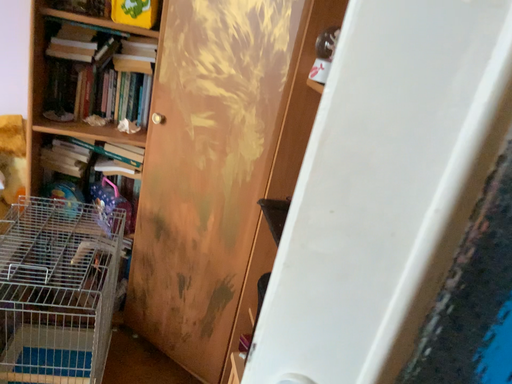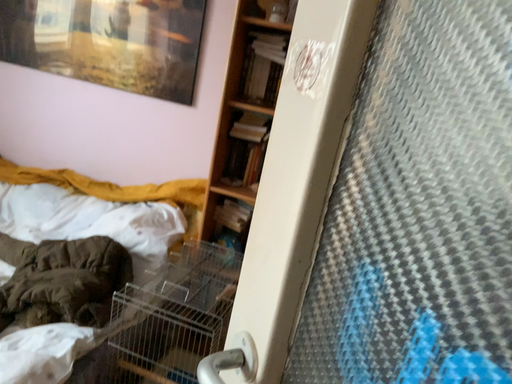
Question: Which way did the camera rotate in the video?

Choices:
 (A) rotated left
 (B) rotated right

Answer: (A)